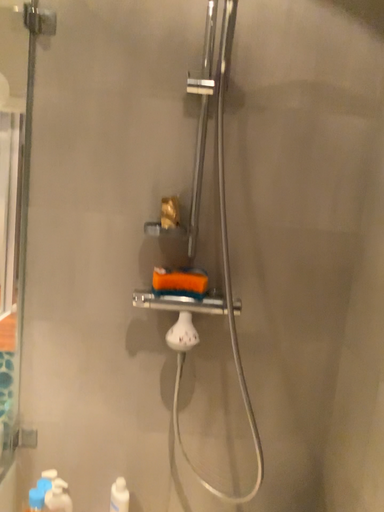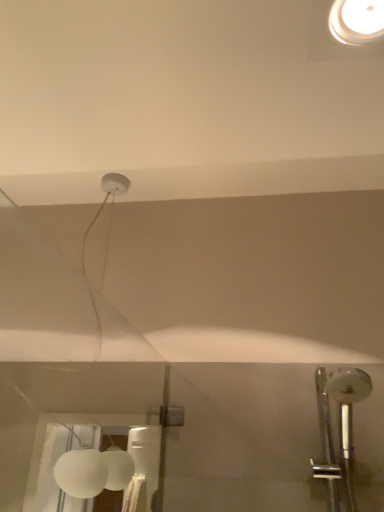
Question: Which way did the camera rotate in the video?

Choices:
 (A) rotated left
 (B) rotated right

Answer: (A)